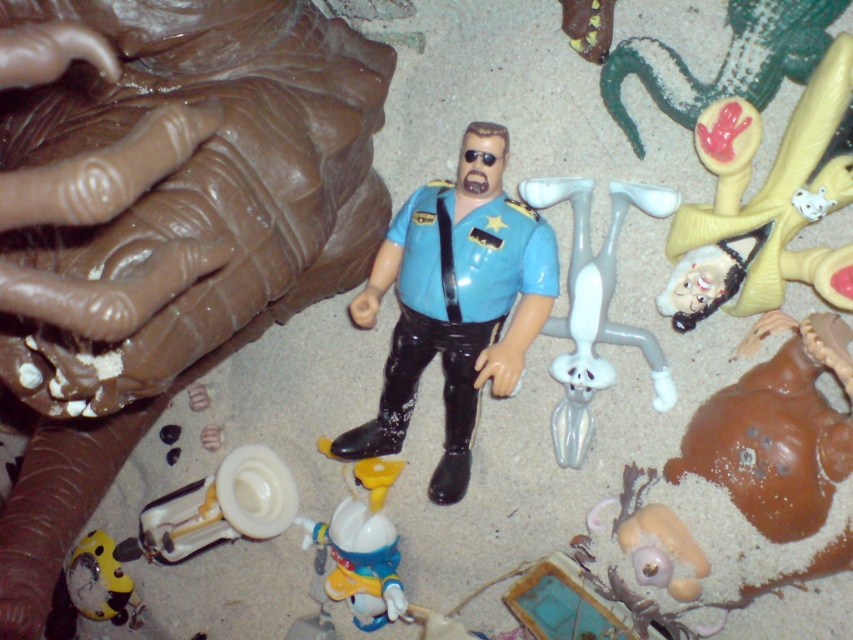
Question: Which point appears closest to the camera in this image?

Choices:
 (A) (486, 292)
 (B) (843, 189)

Answer: (B)

Question: Can you confirm if blue glossy uniform at center is positioned above yellow matte clock at lower left?

Choices:
 (A) no
 (B) yes

Answer: (B)

Question: Among these points, which one is nearest to the camera?

Choices:
 (A) (122, 579)
 (B) (834, 188)

Answer: (B)

Question: Which object is farther from the camera taking this photo?

Choices:
 (A) yellow rubber figure at upper right
 (B) shiny blue plastic toy at lower center
 (C) yellow matte clock at lower left

Answer: (C)

Question: Is yellow rubber figure at upper right bigger than yellow matte clock at lower left?

Choices:
 (A) no
 (B) yes

Answer: (B)

Question: Is white matte rabbit at center positioned at the back of shiny blue plastic toy at lower center?

Choices:
 (A) no
 (B) yes

Answer: (A)